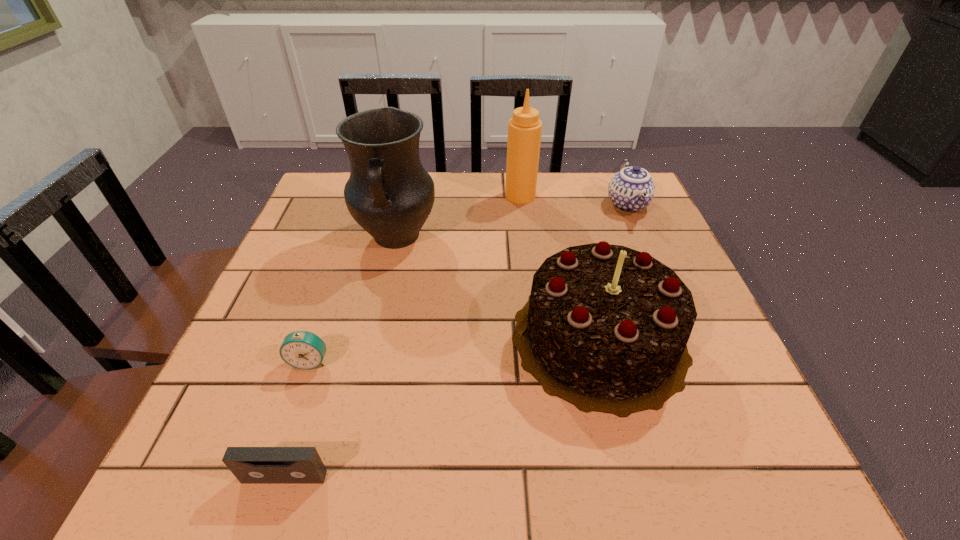
The image size is (960, 540). I want to click on free space between the alarm clock and the condiment, so click(415, 278).

At what (x,y) coordinates should I click in order to perform the action: click on empty space between the pitcher and the alarm clock. Please return your answer as a coordinate pair (x, y). Looking at the image, I should click on (353, 299).

Locate an element on the screen. vacant area that lies between the condiment and the alarm clock is located at coordinates (415, 278).

Locate an element on the screen. This screenshot has height=540, width=960. free space between the pitcher and the birthday cake is located at coordinates (498, 287).

Locate an element on the screen. Image resolution: width=960 pixels, height=540 pixels. empty location between the alarm clock and the pitcher is located at coordinates (353, 299).

This screenshot has height=540, width=960. Identify the location of empty space between the fourth tallest object and the alarm clock. (468, 282).

Locate an element on the screen. The height and width of the screenshot is (540, 960). empty space between the pitcher and the fourth tallest object is located at coordinates (512, 220).

Identify the location of object that stands as the third closest to the chinaware. (389, 194).

I want to click on the fourth closest object to the condiment, so click(x=304, y=350).